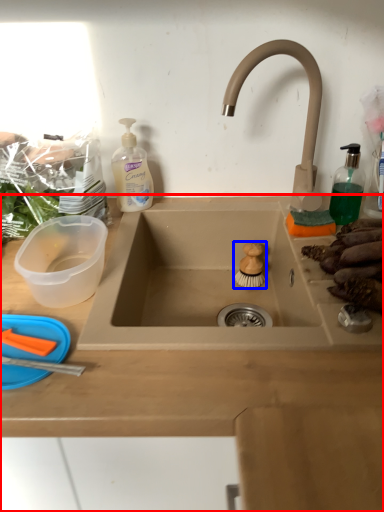
Question: Which point is closer to the camera, countertop (highlighted by a red box) or food (highlighted by a blue box)?

Choices:
 (A) countertop
 (B) food

Answer: (A)